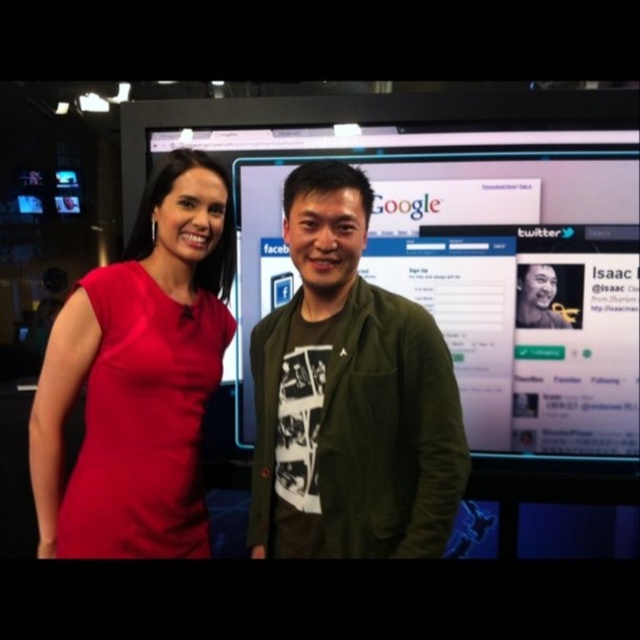
Question: Does green textured jacket at center have a lesser width compared to matte red dress at left?

Choices:
 (A) yes
 (B) no

Answer: (B)

Question: Which point is closer to the camera taking this photo?

Choices:
 (A) (157, 532)
 (B) (326, 168)

Answer: (B)

Question: Which of the following is the closest to the observer?

Choices:
 (A) (36, 401)
 (B) (442, 458)

Answer: (B)

Question: Can you confirm if green textured jacket at center is thinner than matte red dress at left?

Choices:
 (A) no
 (B) yes

Answer: (A)

Question: Is green textured jacket at center behind matte red dress at left?

Choices:
 (A) no
 (B) yes

Answer: (A)